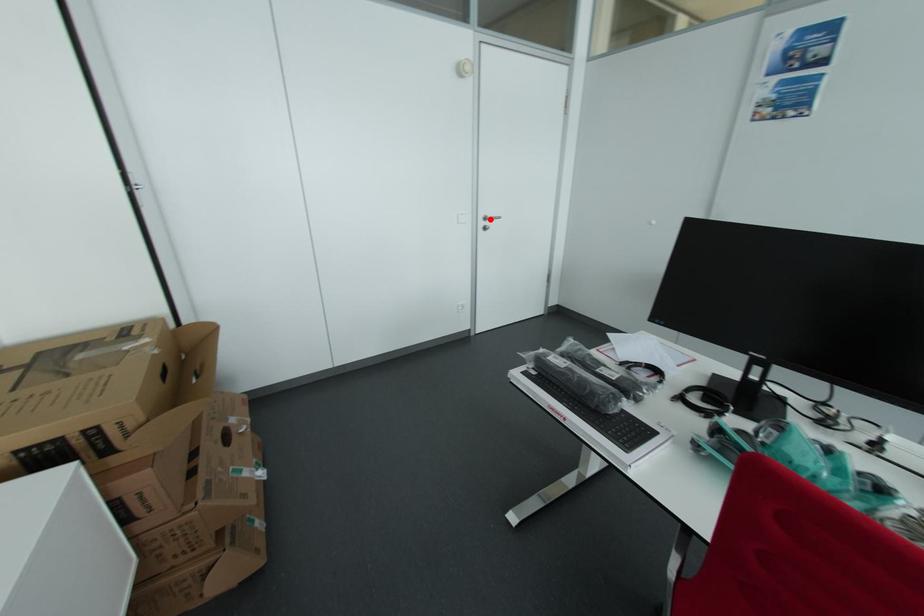
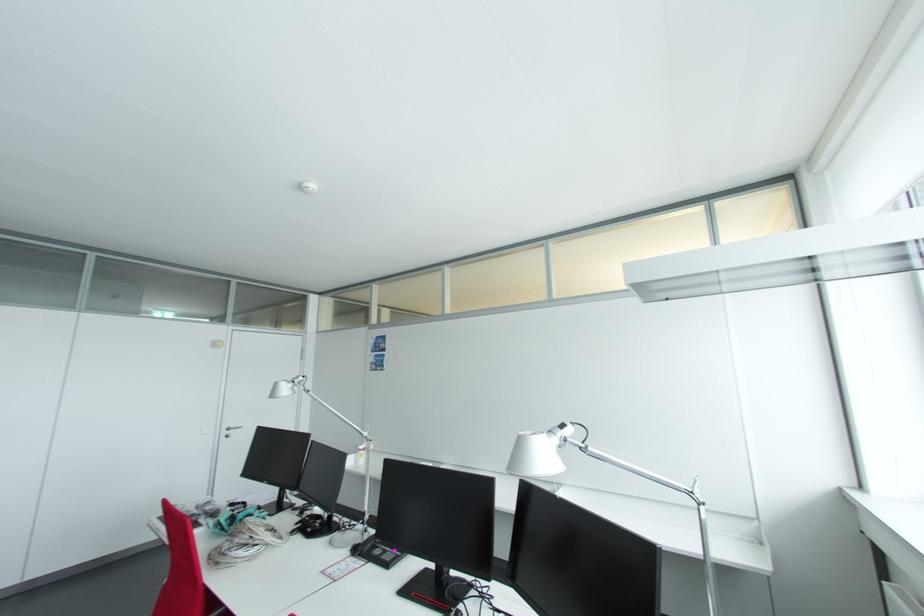
Question: A red point is marked in image1. In image2, is the corresponding 3D point closer to the camera or farther? Reply with the corresponding letter.

Choices:
 (A) The corresponding 3D point is closer.
 (B) The corresponding 3D point is farther.

Answer: (B)